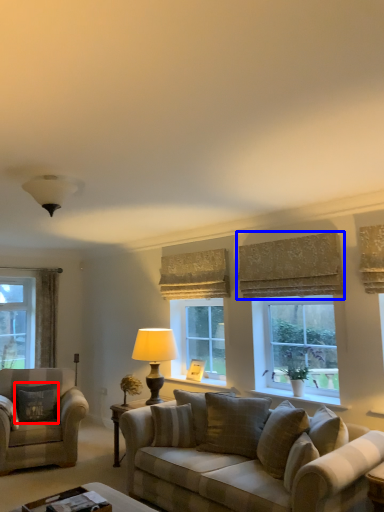
Question: Which object is closer to the camera taking this photo, pillow (highlighted by a red box) or curtain (highlighted by a blue box)?

Choices:
 (A) pillow
 (B) curtain

Answer: (B)